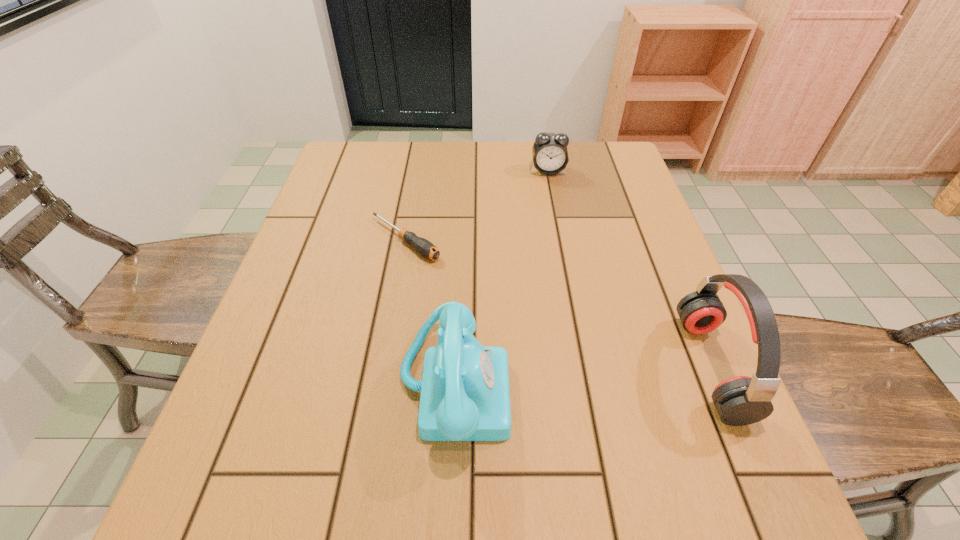
Locate an element on the screen. The image size is (960, 540). vacant region located on the ear cups of the tallest object is located at coordinates (505, 367).

Identify the location of free space located at the tip of the third nearest object. This screenshot has height=540, width=960. (473, 285).

Identify the location of free spot located at the tip of the third nearest object. The image size is (960, 540). (493, 299).

At what (x,y) coordinates should I click in order to perform the action: click on vacant space located at the tip of the third nearest object. Please return your answer as a coordinate pair (x, y). The image size is (960, 540). Looking at the image, I should click on (473, 285).

The image size is (960, 540). I want to click on vacant space located 0.310m on the front side of the farthest object, so click(x=561, y=249).

Locate an element on the screen. The height and width of the screenshot is (540, 960). free spot located 0.280m on the front side of the farthest object is located at coordinates (560, 241).

The width and height of the screenshot is (960, 540). I want to click on vacant region located 0.190m on the front side of the farthest object, so click(x=556, y=218).

This screenshot has width=960, height=540. Find the location of `object that is at the far edge`. object that is at the far edge is located at coordinates (550, 156).

Where is `telephone that is positioned at the near edge`? This screenshot has height=540, width=960. telephone that is positioned at the near edge is located at coordinates (465, 396).

Locate an element on the screen. This screenshot has width=960, height=540. earphone located at the near edge is located at coordinates (741, 400).